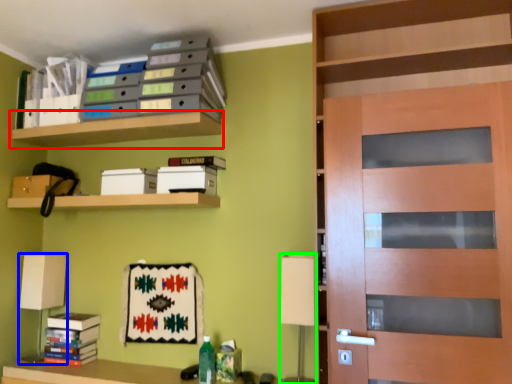
Question: Estimate the real-world distances between objects in this image. Which object is farther from shelf (highlighted by a red box), table lamp (highlighted by a blue box) or table lamp (highlighted by a green box)?

Choices:
 (A) table lamp
 (B) table lamp

Answer: (B)